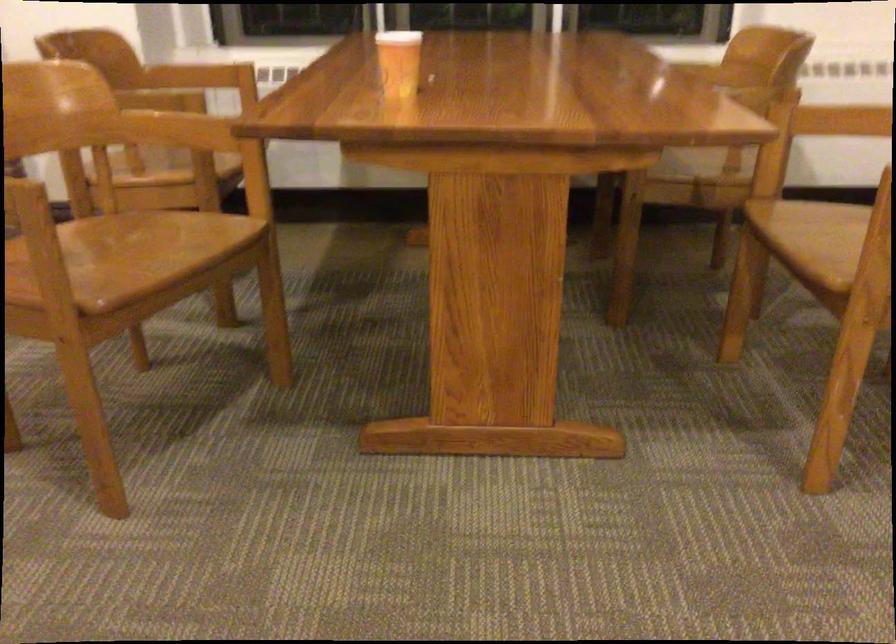
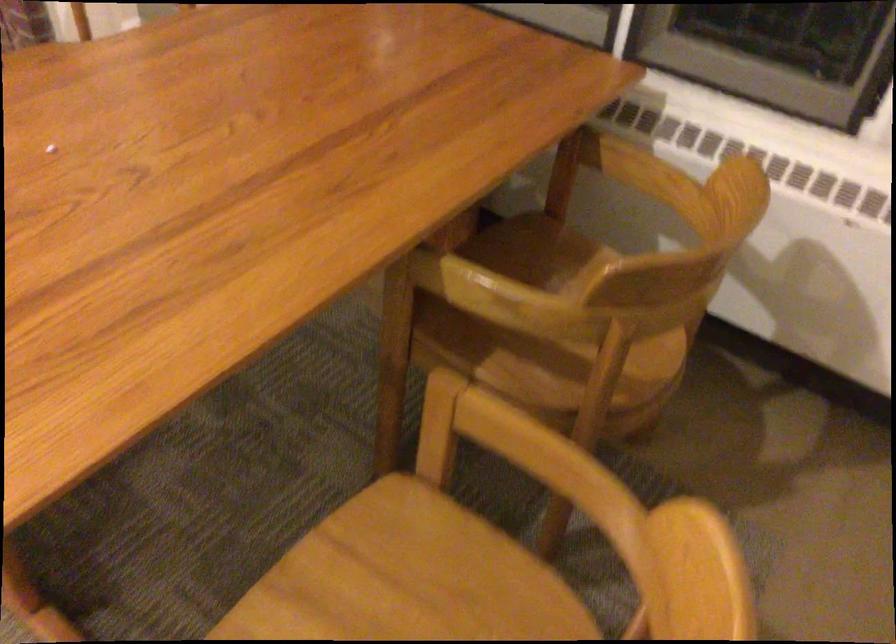
In the second image, find the point that corresponds to [747,108] in the first image.

(545, 330)